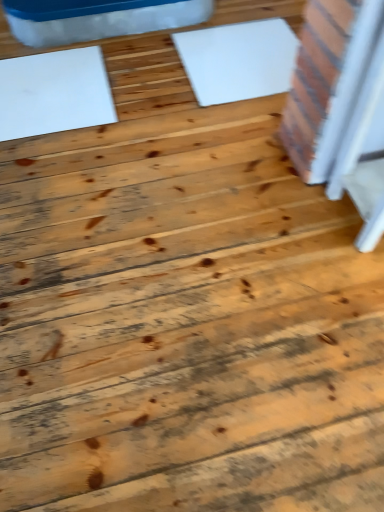
Where is `white plastic chair at right`? Image resolution: width=384 pixels, height=512 pixels. white plastic chair at right is located at coordinates (334, 89).

In order to face white plastic chair at right, should I rotate leftwards or rightwards?

A 27.227 degree turn to the right will do.

This screenshot has width=384, height=512. What do you see at coordinates (334, 89) in the screenshot?
I see `white plastic chair at right` at bounding box center [334, 89].

At what (x,y) coordinates should I click in order to perform the action: click on white plastic chair at right. Please return your answer as a coordinate pair (x, y). Looking at the image, I should click on (334, 89).